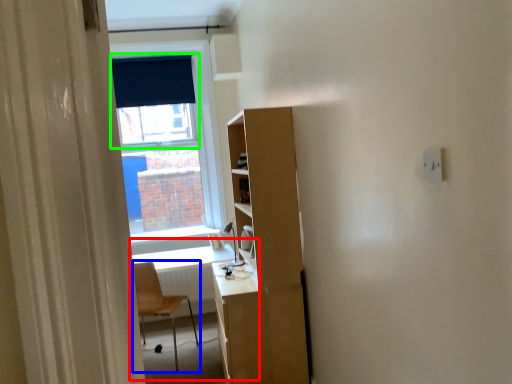
Question: Based on their relative distances, which object is farther from computer desk (highlighted by a red box)? Choose from chair (highlighted by a blue box) and window screen (highlighted by a green box).

Choices:
 (A) chair
 (B) window screen

Answer: (B)